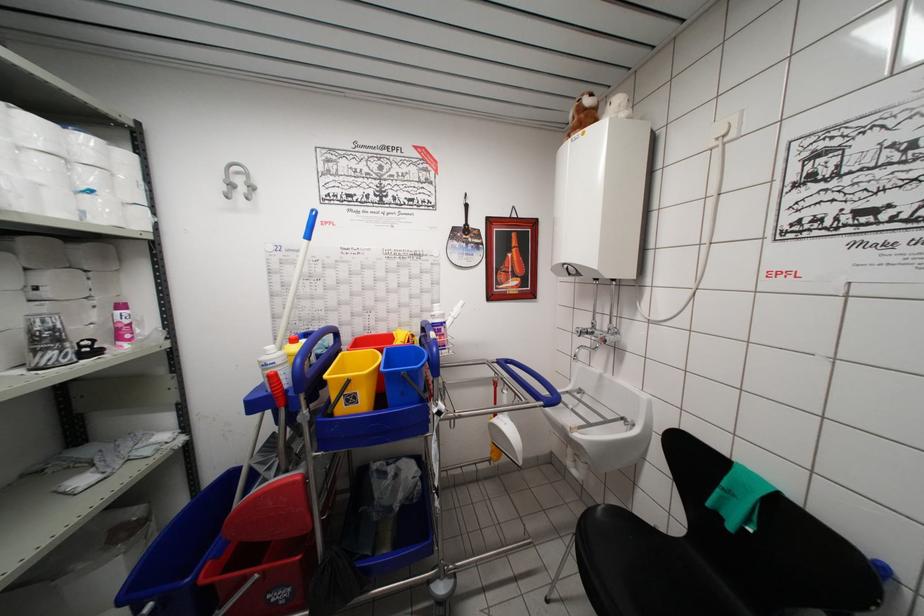
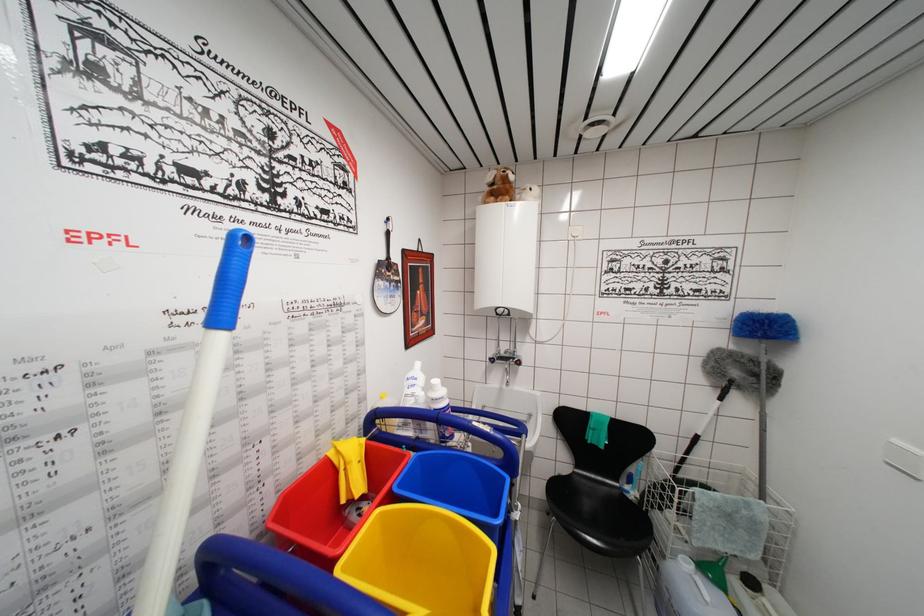
Question: How did the camera likely rotate?

Choices:
 (A) Left
 (B) Right
 (C) Up
 (D) Down

Answer: (B)